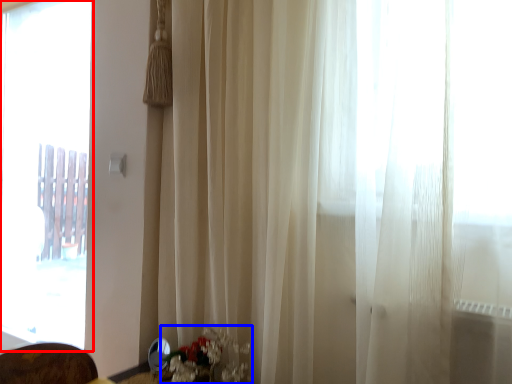
Question: Which object is further to the camera taking this photo, window (highlighted by a red box) or floral arrangement (highlighted by a blue box)?

Choices:
 (A) window
 (B) floral arrangement

Answer: (A)